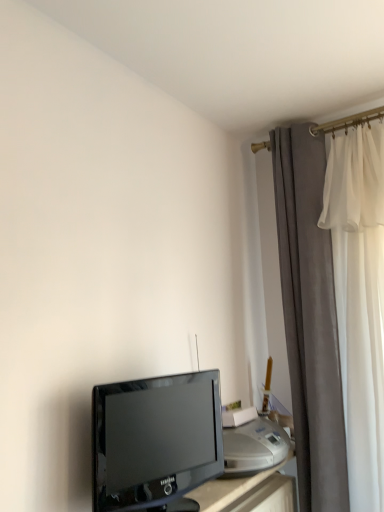
Question: Is satin silver printer at lower right with black glossy television at lower left?

Choices:
 (A) no
 (B) yes

Answer: (A)

Question: Would you say black glossy television at lower left is part of satin silver printer at lower right's contents?

Choices:
 (A) no
 (B) yes

Answer: (A)

Question: Considering the relative sizes of satin silver printer at lower right and black glossy television at lower left in the image provided, is satin silver printer at lower right smaller than black glossy television at lower left?

Choices:
 (A) yes
 (B) no

Answer: (A)

Question: Is satin silver printer at lower right at the right side of black glossy television at lower left?

Choices:
 (A) yes
 (B) no

Answer: (A)

Question: Is satin silver printer at lower right oriented towards black glossy television at lower left?

Choices:
 (A) no
 (B) yes

Answer: (A)

Question: Can you confirm if satin silver printer at lower right is thinner than black glossy television at lower left?

Choices:
 (A) no
 (B) yes

Answer: (A)

Question: Can you confirm if black glossy television at lower left is positioned to the right of velvet gray curtain at right?

Choices:
 (A) yes
 (B) no

Answer: (B)

Question: Is black glossy television at lower left turned away from velvet gray curtain at right?

Choices:
 (A) no
 (B) yes

Answer: (A)

Question: Considering the relative sizes of black glossy television at lower left and velvet gray curtain at right in the image provided, is black glossy television at lower left thinner than velvet gray curtain at right?

Choices:
 (A) no
 (B) yes

Answer: (B)

Question: Can you confirm if black glossy television at lower left is wider than velvet gray curtain at right?

Choices:
 (A) no
 (B) yes

Answer: (A)

Question: Would you say velvet gray curtain at right is part of black glossy television at lower left's contents?

Choices:
 (A) yes
 (B) no

Answer: (B)

Question: Is the depth of black glossy television at lower left greater than that of velvet gray curtain at right?

Choices:
 (A) no
 (B) yes

Answer: (A)

Question: Can satin silver printer at lower right be found inside velvet gray curtain at right?

Choices:
 (A) yes
 (B) no

Answer: (B)